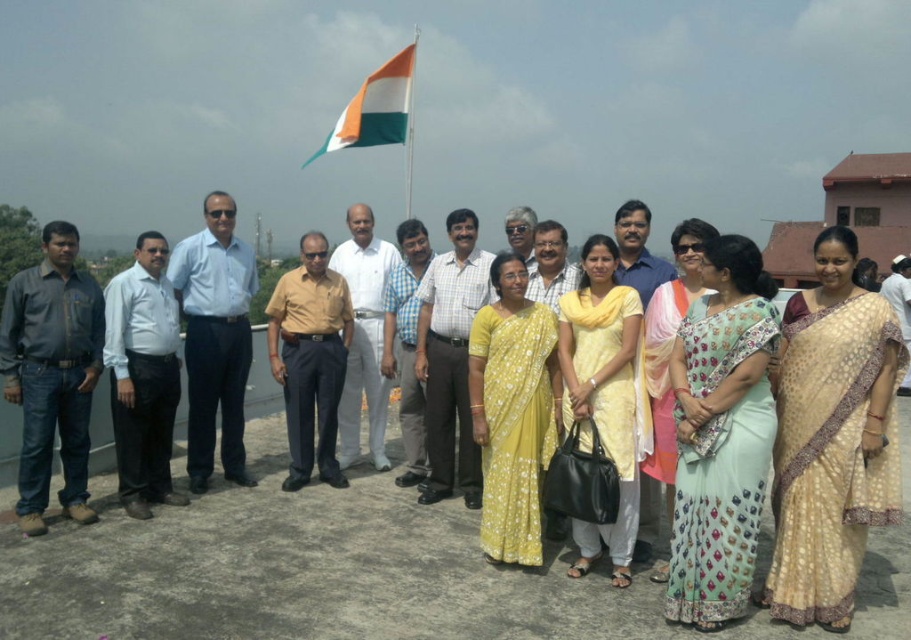
You are a photographer taking a picture of the dark gray shirt at left and the blue shirt at center. Which person should you adjust the camera focus to capture the one closer to the front?

The dark gray shirt at left is positioned under the blue shirt at center, meaning the blue shirt at center is closer to the front. Therefore, to capture the person in front, adjust the focus on the blue shirt at center.

You are a photographer at this event and need to capture a photo where both the light brown shirt at center and the matte white shirt at center are visible. Given their heights, which shirt should you focus on to ensure both are in frame?

The light brown shirt at center is taller than the matte white shirt at center, so focusing on the light brown shirt at center will ensure both are visible in the frame as the taller one will not block the shorter one if positioned correctly.